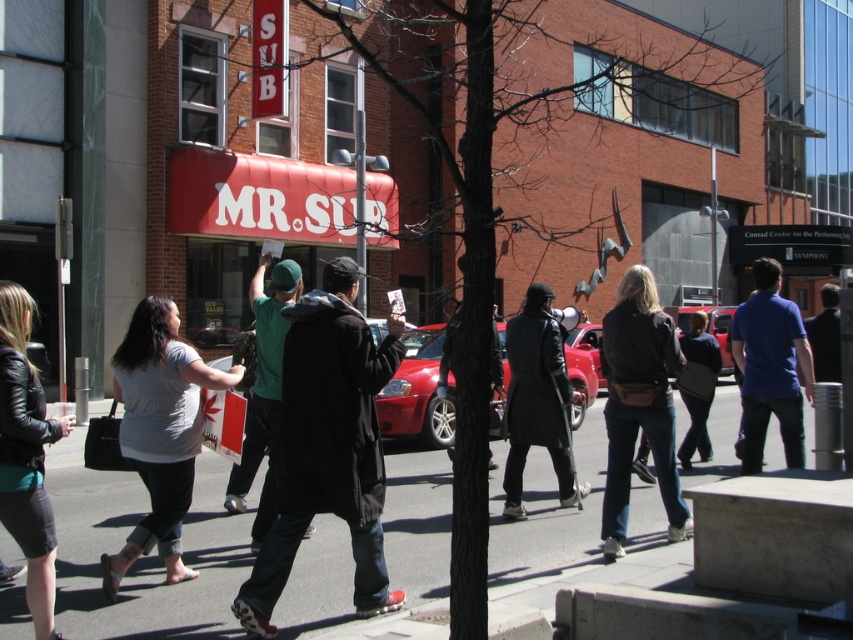
Question: Does black leather coat at center lie behind green fabric shirt at center?

Choices:
 (A) no
 (B) yes

Answer: (B)

Question: Which of the following is the farthest from the observer?

Choices:
 (A) black matte coat at center
 (B) leather jacket at left
 (C) black leather coat at center
 (D) blue cotton shirt at right

Answer: (C)

Question: Is smooth concrete pavement at center closer to the viewer compared to leather jacket at left?

Choices:
 (A) yes
 (B) no

Answer: (B)

Question: Estimate the real-world distances between objects in this image. Which object is farther from the dark brown leather jacket at center?

Choices:
 (A) smooth concrete pavement at center
 (B) dark blue jacket at right
 (C) shiny red car at center

Answer: (C)

Question: Does leather jacket at left have a smaller size compared to blue cotton shirt at right?

Choices:
 (A) yes
 (B) no

Answer: (A)

Question: Among these points, which one is nearest to the camera?

Choices:
 (A) (741, 468)
 (B) (693, 432)

Answer: (A)